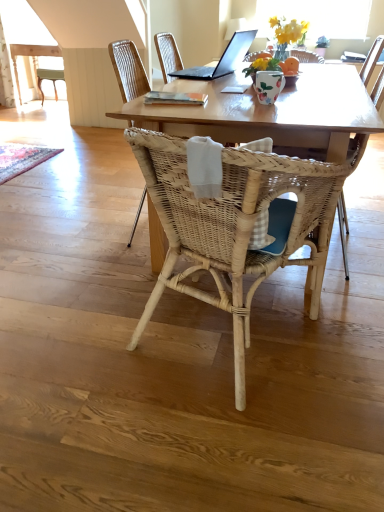
Image resolution: width=384 pixels, height=512 pixels. I want to click on vacant position to the left of floral ceramic vase at upper center, so click(x=241, y=97).